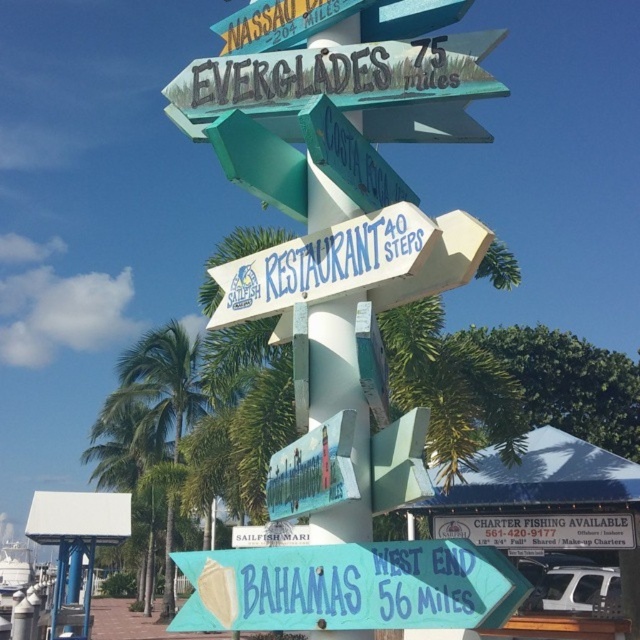
You are standing in front of the signpost and want to know which direction leads to Costa Rica. The green painted wooden signpost at upper center and the blue painted wooden sign at center are both pointing in different directions. Which sign should you follow to find the correct direction to Costa Rica?

The green painted wooden signpost at upper center is the one directing towards Costa Rica, so you should follow the green painted wooden signpost at upper center.

Consider the image. You are standing at the origin point of the coordinate system. Where is the green painted wooden signpost at upper center located?

The green painted wooden signpost at upper center is located at point (x=337, y=76).

You are standing at the base of the signpost and want to take a photo of the point marked at coordinates point (180,432). Your camera has a maximum focus range of 30 meters. Will the camera be able to focus on the point?

The distance of point (180,432) from camera is 30.13 meters, which is slightly beyond the camera maximum focus range of 30 meters. The camera will not be able to focus on the point.